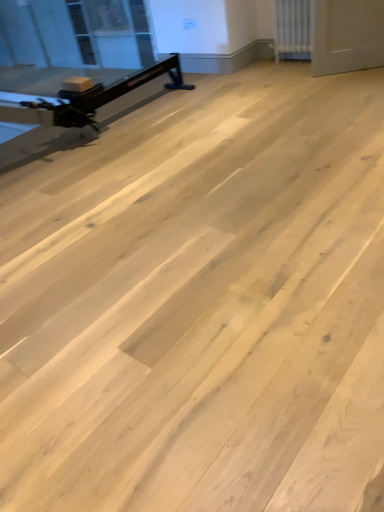
At what (x,y) coordinates should I click in order to perform the action: click on vacant area situated to the left side of white textured radiator at upper right. Please return your answer as a coordinate pair (x, y). Looking at the image, I should click on (273, 65).